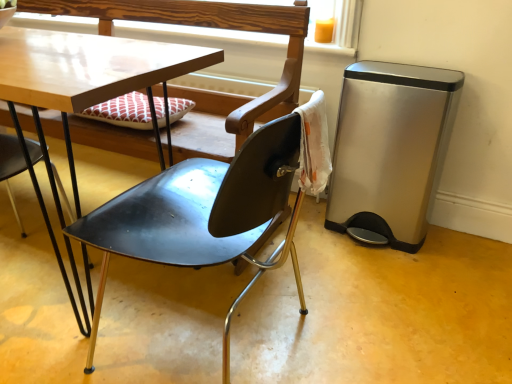
Locate an element on the screen. The width and height of the screenshot is (512, 384). spots to the right of black metal chair at lower left, which appears as the 1th chair when viewed from the left is located at coordinates (100, 307).